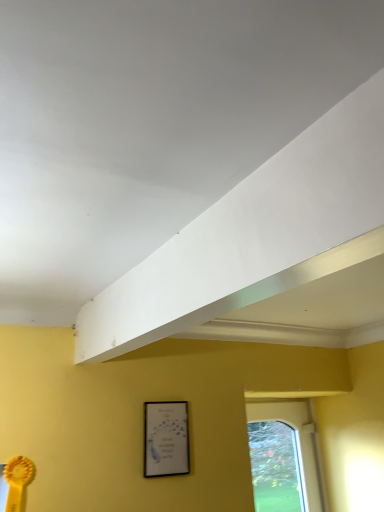
Question: Is clear glass window at lower right aimed at matte black picture frame at lower center?

Choices:
 (A) yes
 (B) no

Answer: (B)

Question: Can you confirm if clear glass window at lower right is bigger than matte black picture frame at lower center?

Choices:
 (A) no
 (B) yes

Answer: (B)

Question: From the image's perspective, would you say clear glass window at lower right is positioned over matte black picture frame at lower center?

Choices:
 (A) no
 (B) yes

Answer: (A)

Question: From a real-world perspective, is clear glass window at lower right located beneath matte black picture frame at lower center?

Choices:
 (A) no
 (B) yes

Answer: (B)

Question: Considering the relative sizes of clear glass window at lower right and matte black picture frame at lower center in the image provided, is clear glass window at lower right smaller than matte black picture frame at lower center?

Choices:
 (A) no
 (B) yes

Answer: (A)

Question: Does clear glass window at lower right have a lesser height compared to matte black picture frame at lower center?

Choices:
 (A) no
 (B) yes

Answer: (A)

Question: Could you tell me if matte black picture frame at lower center is facing clear glass window at lower right?

Choices:
 (A) yes
 (B) no

Answer: (B)

Question: From a real-world perspective, is matte black picture frame at lower center positioned over clear glass window at lower right based on gravity?

Choices:
 (A) no
 (B) yes

Answer: (B)

Question: Is matte black picture frame at lower center further to camera compared to clear glass window at lower right?

Choices:
 (A) yes
 (B) no

Answer: (B)

Question: Considering the relative sizes of matte black picture frame at lower center and clear glass window at lower right in the image provided, is matte black picture frame at lower center bigger than clear glass window at lower right?

Choices:
 (A) no
 (B) yes

Answer: (A)

Question: From a real-world perspective, is matte black picture frame at lower center located beneath clear glass window at lower right?

Choices:
 (A) yes
 (B) no

Answer: (B)

Question: Is matte black picture frame at lower center smaller than clear glass window at lower right?

Choices:
 (A) no
 (B) yes

Answer: (B)

Question: Are white matte exhaust hood at upper center and clear glass window at lower right making contact?

Choices:
 (A) no
 (B) yes

Answer: (A)